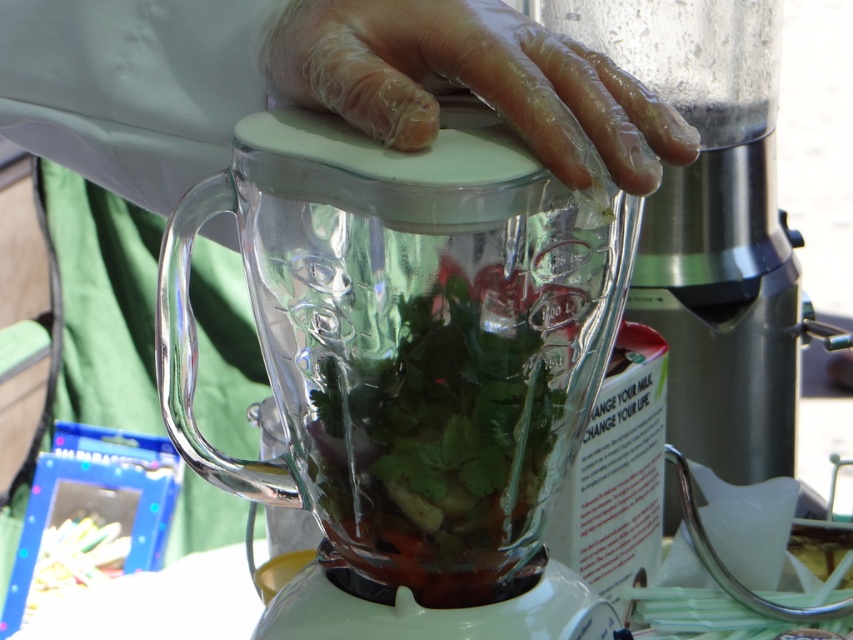
Question: Is transparent glass blender at center below transparent glass food processor at center?

Choices:
 (A) no
 (B) yes

Answer: (B)

Question: In this image, where is transparent glass food processor at center located relative to clear plastic glove at center?

Choices:
 (A) right
 (B) left

Answer: (A)

Question: Which point appears farthest from the camera in this image?

Choices:
 (A) (747, 400)
 (B) (337, 12)

Answer: (A)

Question: Which of these objects is positioned closest to the transparent glass blender at center?

Choices:
 (A) clear plastic glove at center
 (B) transparent glass food processor at center

Answer: (A)

Question: Which object appears closest to the camera in this image?

Choices:
 (A) transparent glass blender at center
 (B) transparent glass food processor at center
 (C) clear plastic glove at center

Answer: (A)

Question: Is transparent glass blender at center wider than clear plastic glove at center?

Choices:
 (A) yes
 (B) no

Answer: (A)